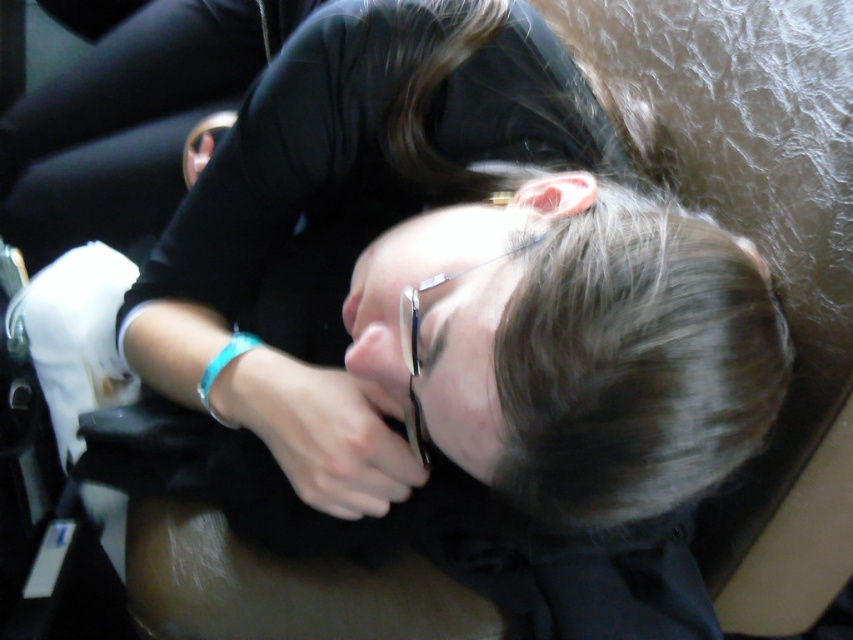
Question: Does dark brown silky hair at center have a greater width compared to smooth skin hand at center?

Choices:
 (A) no
 (B) yes

Answer: (B)

Question: Estimate the real-world distances between objects in this image. Which object is closer to the turquoise plastic bracelet at lower center?

Choices:
 (A) smooth skin hand at center
 (B) dark brown silky hair at center

Answer: (A)

Question: Which point is farther to the camera?

Choices:
 (A) turquoise plastic bracelet at lower center
 (B) smooth skin hand at center

Answer: (A)

Question: Among these objects, which one is nearest to the camera?

Choices:
 (A) smooth skin hand at center
 (B) dark brown silky hair at center
 (C) turquoise plastic bracelet at lower center

Answer: (B)

Question: Is dark brown silky hair at center further to the viewer compared to smooth skin hand at center?

Choices:
 (A) no
 (B) yes

Answer: (A)

Question: Does smooth skin hand at center appear over turquoise plastic bracelet at lower center?

Choices:
 (A) yes
 (B) no

Answer: (B)